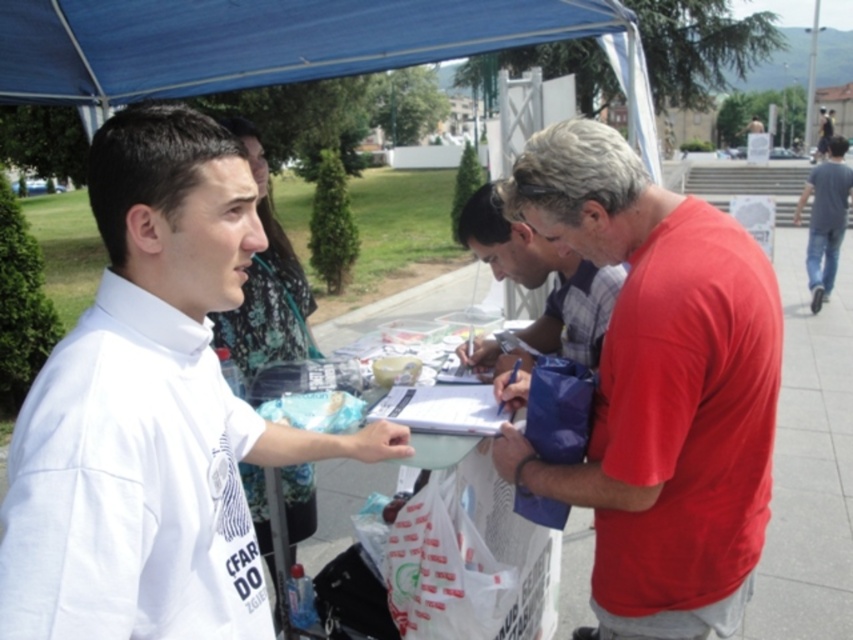
Question: Which object appears closest to the camera in this image?

Choices:
 (A) matte red t-shirt at right
 (B) matte red shirt at center
 (C) blue jeans at right
 (D) white cotton shirt at center

Answer: (D)

Question: Based on their relative distances, which object is nearer to the blue jeans at right?

Choices:
 (A) matte red shirt at center
 (B) matte red t-shirt at right

Answer: (A)

Question: Is matte red shirt at center thinner than blue jeans at right?

Choices:
 (A) yes
 (B) no

Answer: (A)

Question: From the image, what is the correct spatial relationship of white cotton shirt at center in relation to blue jeans at right?

Choices:
 (A) above
 (B) below

Answer: (B)

Question: Which point is closer to the camera?

Choices:
 (A) (120, 400)
 (B) (595, 592)
 (C) (819, 182)

Answer: (A)

Question: Can you confirm if white cotton shirt at center is thinner than matte red shirt at center?

Choices:
 (A) yes
 (B) no

Answer: (B)